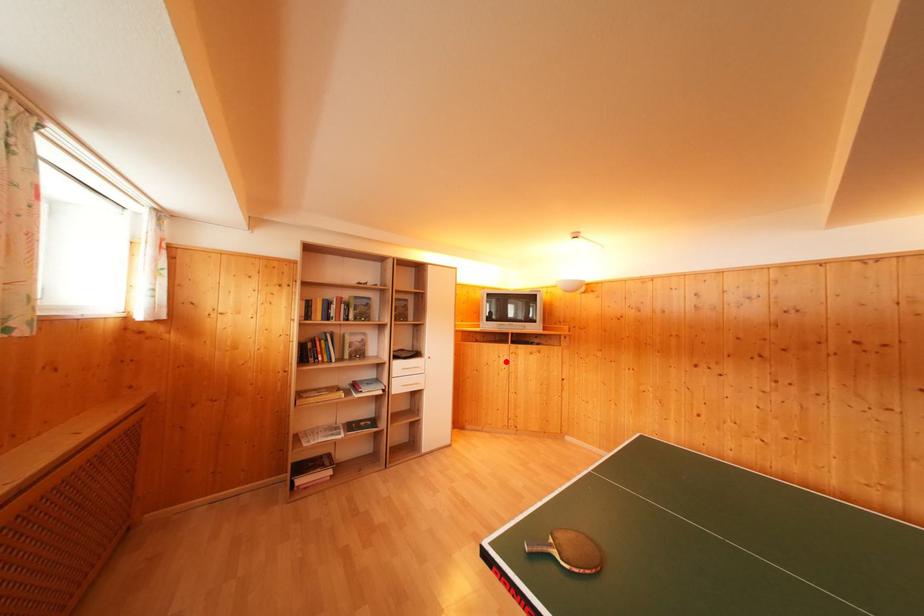
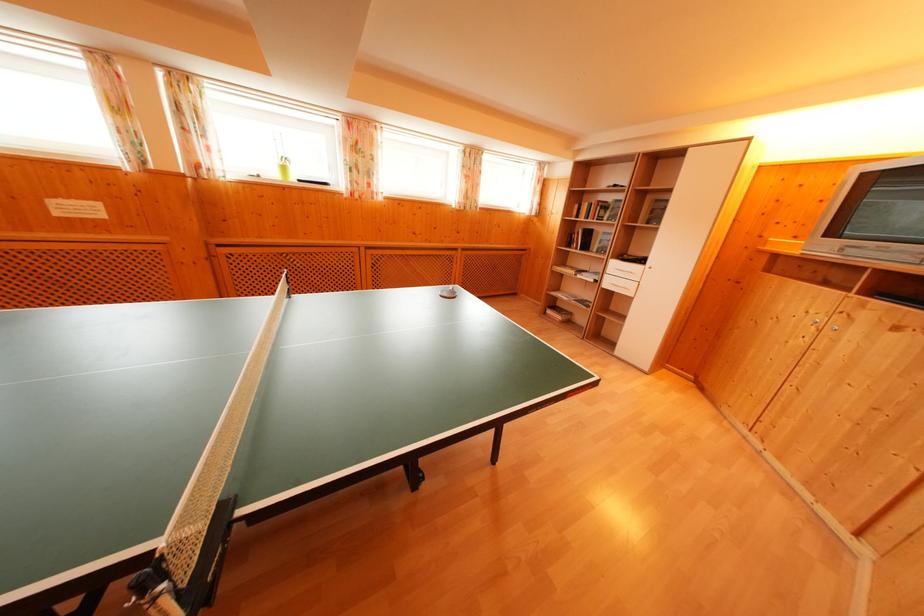
In the second image, find the point that corresponds to the highlighted location in the first image.

(817, 317)